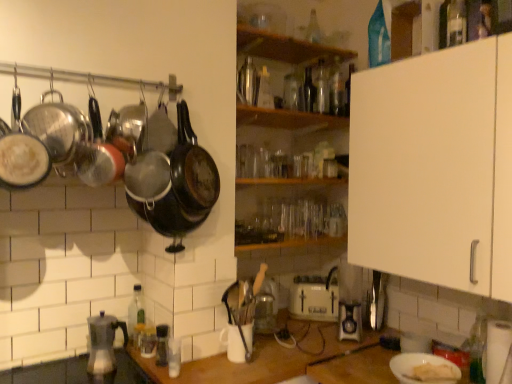
Question: Is transparent glass bottle at upper center, which is the 2th bottle from right to left, inside the boundaries of black matte wok at upper center, acting as the third wok starting from the left, or outside?

Choices:
 (A) inside
 (B) outside

Answer: (B)

Question: Relative to black matte wok at upper center, acting as the third wok starting from the left, is transparent glass bottle at upper center, which is the 2th bottle from right to left, in front or behind?

Choices:
 (A) front
 (B) behind

Answer: (B)

Question: Based on their relative distances, which object is nearer to the metallic glass bottle at upper center, the second bottle positioned from the left?

Choices:
 (A) white matte plate at lower right, the 1th appliance when ordered from front to back
 (B) green glass bottle at lower left, placed as the first bottle when sorted from left to right
 (C) wooden shelf at upper center, positioned as the second shelf in bottom-to-top order
 (D) matte black frying pan at left
 (E) black matte wok at upper left, which is counted as the third wok, starting from the right

Answer: (C)

Question: Considering the real-world distances, which object is closest to the black matte wok at upper left, which is counted as the third wok, starting from the right?

Choices:
 (A) black matte wok at left, the first wok in the right-to-left sequence
 (B) transparent glass bottle at upper right, which ranks as the 1th bottle in right-to-left order
 (C) matte black frying pan at left
 (D) transparent glass bottle at upper center, arranged as the seventh bottle when viewed from the left
 (E) wooden shelf at center, the first shelf ordered from the bottom

Answer: (A)